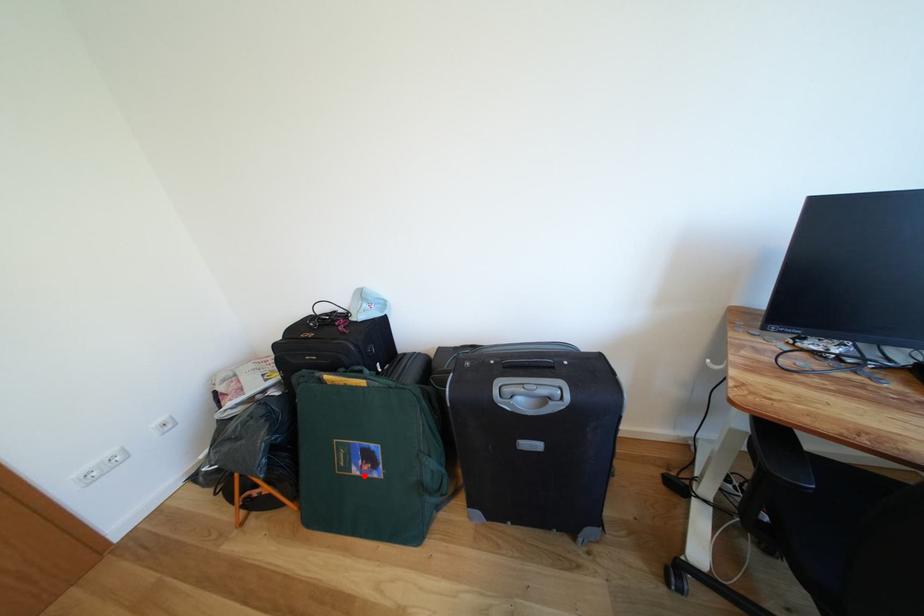
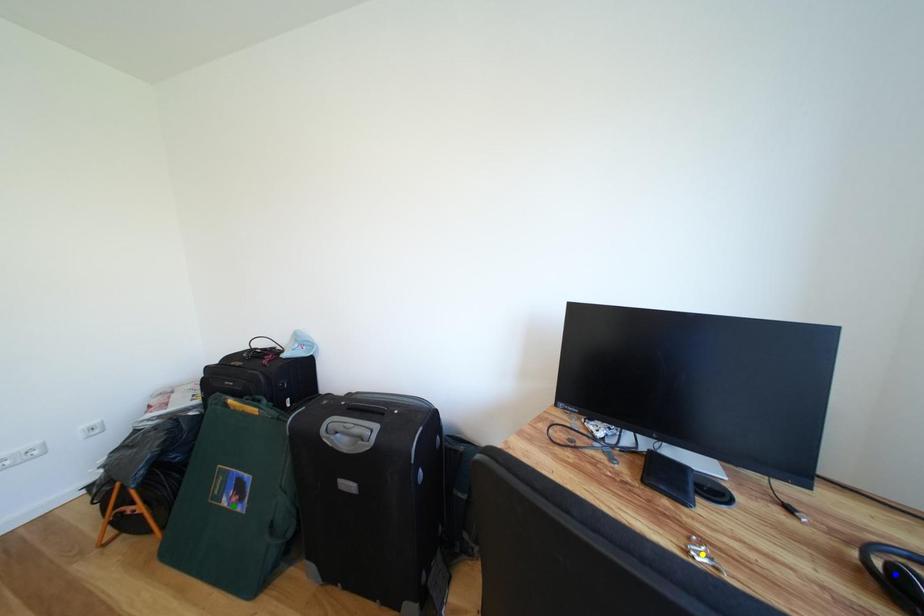
Question: I am providing you with two images of the same scene from different viewpoints. A red point is marked on the first image. You are given multiple points on the second image. Which point in image 2 represents the same 3d spot as the red point in image 1?

Choices:
 (A) green point
 (B) yellow point
 (C) blue point

Answer: (A)